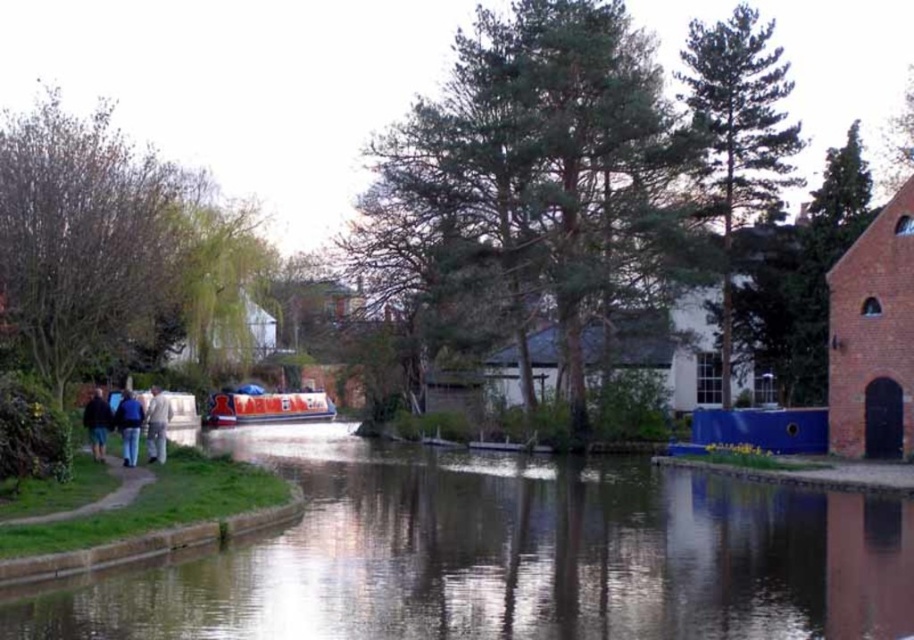
Question: Considering the real-world distances, which object is farthest from the white glossy canal boat at center?

Choices:
 (A) white cotton pants at left
 (B) smooth reflective water at center
 (C) dark blue jeans at lower left
 (D) light blue jeans at center

Answer: (B)

Question: Is white glossy canal boat at center above light blue jeans at center?

Choices:
 (A) no
 (B) yes

Answer: (A)

Question: Based on their relative distances, which object is nearer to the blue jeans at lower left?

Choices:
 (A) dark blue jeans at lower left
 (B) white glossy canal boat at center
 (C) smooth reflective water at center
 (D) light blue jeans at center

Answer: (D)

Question: Can you confirm if light blue jeans at center is positioned to the left of dark blue jeans at lower left?

Choices:
 (A) no
 (B) yes

Answer: (B)

Question: Which point is farther to the camera?

Choices:
 (A) white glossy canal boat at center
 (B) dark blue jeans at lower left

Answer: (A)

Question: Is the position of blue jeans at lower left less distant than that of dark blue jeans at lower left?

Choices:
 (A) yes
 (B) no

Answer: (A)